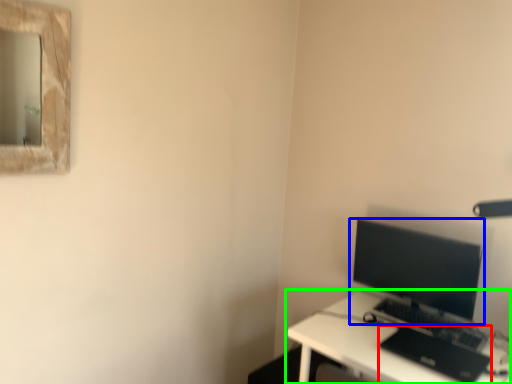
Question: Which object is the farthest from laptop (highlighted by a red box)? Choose among these: computer monitor (highlighted by a blue box) or desk (highlighted by a green box).

Choices:
 (A) computer monitor
 (B) desk

Answer: (A)